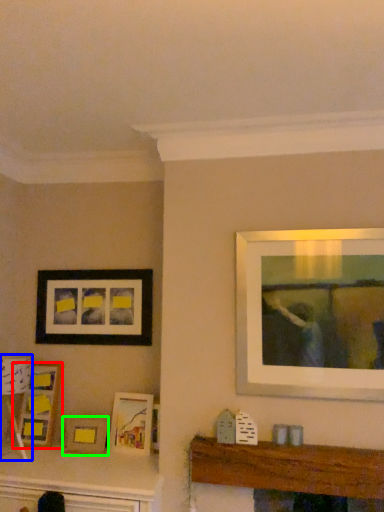
Question: Which object is positioned closest to picture frame (highlighted by a red box)? Select from lamp (highlighted by a blue box) and picture frame (highlighted by a green box).

Choices:
 (A) lamp
 (B) picture frame

Answer: (A)